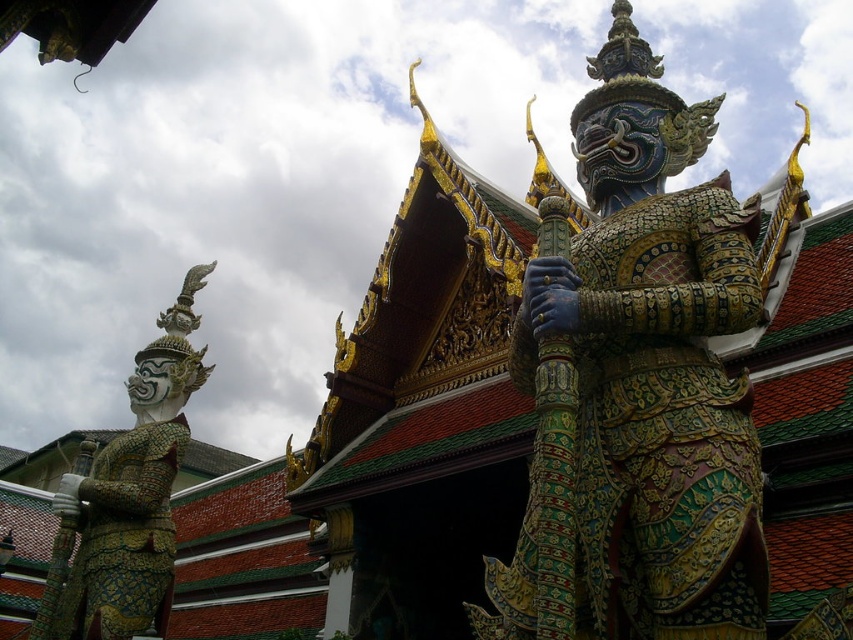
Between point (614, 65) and point (122, 556), which one is positioned behind?

The point (122, 556) is more distant.

Is multicolored ornate statue at center to the right of gold textured armor at left from the viewer's perspective?

Yes, multicolored ornate statue at center is to the right of gold textured armor at left.

Where is `multicolored ornate statue at center`? This screenshot has width=853, height=640. multicolored ornate statue at center is located at coordinates (654, 365).